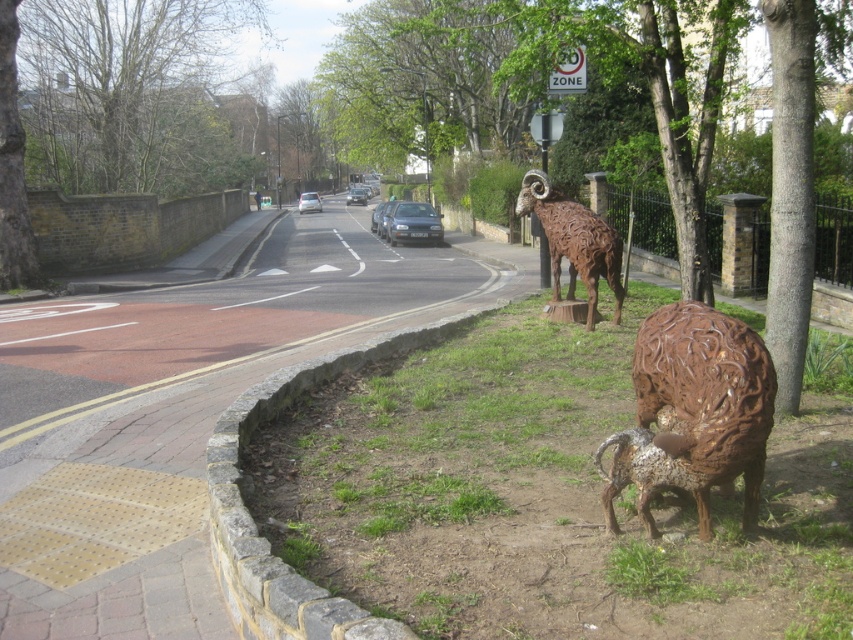
Is brown stone curb at lower center positioned behind silver metallic car at center?

No, brown stone curb at lower center is in front of silver metallic car at center.

In the scene shown: Which is more to the left, brown stone curb at lower center or silver metallic car at center?

From the viewer's perspective, silver metallic car at center appears more on the left side.

Does point (386, 620) lie behind point (302, 205)?

No, (386, 620) is in front of (302, 205).

Locate an element on the screen. This screenshot has height=640, width=853. brown stone curb at lower center is located at coordinates (252, 518).

Can you confirm if rusty metal ram at center-right is thinner than rusty metal ram at center?

Incorrect, rusty metal ram at center-right's width is not less than rusty metal ram at center's.

Does point (767, 412) come closer to viewer compared to point (555, 298)?

Yes, it is.

The height and width of the screenshot is (640, 853). Find the location of `rusty metal ram at center-right`. rusty metal ram at center-right is located at coordinates (704, 403).

Is point (807, 483) farther from viewer compared to point (317, 205)?

That is False.

Is green grass at center positioned in front of silver metallic car at center?

Yes, green grass at center is closer to the viewer.

Is point (332, 547) positioned after point (310, 195)?

No.

You are a GUI agent. You are given a task and a screenshot of the screen. Output one action in this format:
    pyautogui.click(x=<x>, y=<y>)
    Task: Click on the green grass at center
    The width and height of the screenshot is (853, 640).
    Given the screenshot: What is the action you would take?
    pyautogui.click(x=544, y=497)